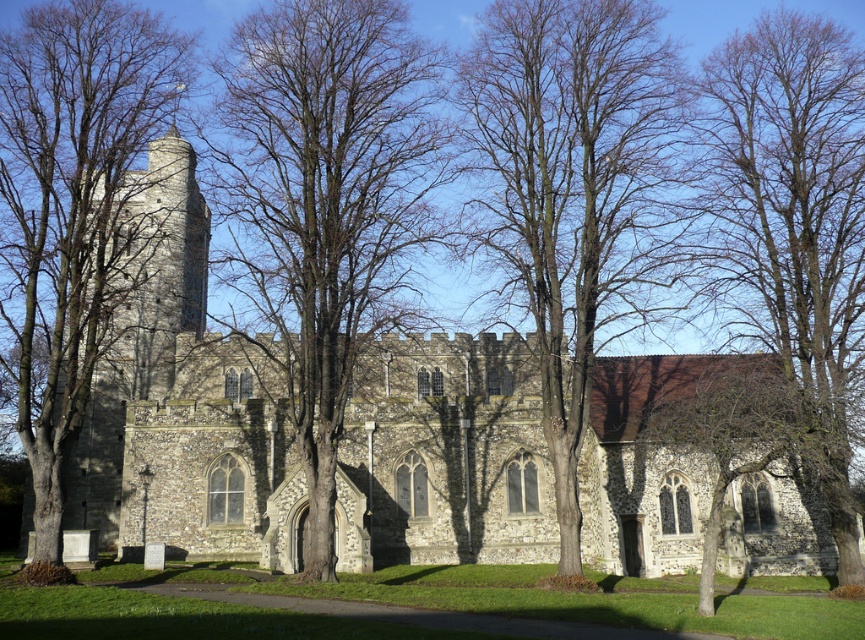
You are a photographer planning to capture the church and its surroundings. You want to include both the bare branches at right and the bare wood tree at left in your shot. Which of these two objects should you position closer to the center of the frame to ensure they are both clearly visible?

Since the bare branches at right is smaller in size compared to the bare wood tree at left, you should position the bare branches at right closer to the center of the frame to ensure both are clearly visible.

You are standing in front of the historic stone church and want to take a photo of the central tower with its conical roof. However, there are bare branches at center blocking your view. Based on their position, can you determine if the branches are in front of or behind the tower?

The bare branches at center are located at point (322, 205), which is in front of the central tower. Therefore, the branches are blocking the view of the tower.

You are standing on the grassy lawn in front of the historic stone church. You see the bare branches at center and the bare wood tree at center. Which object is located above the other?

The bare branches at center are positioned over the bare wood tree at center.